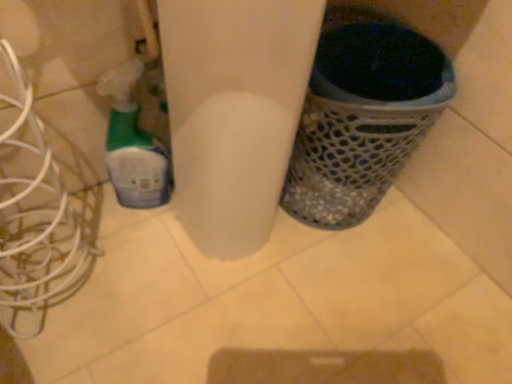
Question: Does translucent plastic spray bottle at left have a lesser width compared to white metallic wires at left?

Choices:
 (A) yes
 (B) no

Answer: (A)

Question: From a real-world perspective, is translucent plastic spray bottle at left physically below white metallic wires at left?

Choices:
 (A) yes
 (B) no

Answer: (A)

Question: Is translucent plastic spray bottle at left oriented away from white metallic wires at left?

Choices:
 (A) yes
 (B) no

Answer: (B)

Question: Is translucent plastic spray bottle at left further to camera compared to white metallic wires at left?

Choices:
 (A) yes
 (B) no

Answer: (A)

Question: Is translucent plastic spray bottle at left at the right side of white metallic wires at left?

Choices:
 (A) no
 (B) yes

Answer: (B)

Question: Considering the positions of metallic mesh waste bin at right and translucent plastic spray bottle at left in the image, is metallic mesh waste bin at right wider or thinner than translucent plastic spray bottle at left?

Choices:
 (A) thin
 (B) wide

Answer: (B)

Question: From a real-world perspective, is metallic mesh waste bin at right physically located above or below translucent plastic spray bottle at left?

Choices:
 (A) above
 (B) below

Answer: (A)

Question: From the image's perspective, is metallic mesh waste bin at right above or below translucent plastic spray bottle at left?

Choices:
 (A) below
 (B) above

Answer: (B)

Question: Considering the positions of metallic mesh waste bin at right and translucent plastic spray bottle at left in the image, is metallic mesh waste bin at right taller or shorter than translucent plastic spray bottle at left?

Choices:
 (A) tall
 (B) short

Answer: (A)

Question: From a real-world perspective, is translucent plastic spray bottle at left physically located above or below metallic mesh waste bin at right?

Choices:
 (A) below
 (B) above

Answer: (A)

Question: In the image, is translucent plastic spray bottle at left positioned in front of or behind metallic mesh waste bin at right?

Choices:
 (A) behind
 (B) front

Answer: (A)

Question: Is translucent plastic spray bottle at left spatially inside metallic mesh waste bin at right, or outside of it?

Choices:
 (A) inside
 (B) outside

Answer: (B)

Question: Based on their positions, is translucent plastic spray bottle at left located to the left or right of metallic mesh waste bin at right?

Choices:
 (A) left
 (B) right

Answer: (A)

Question: Is white metallic wires at left wider or thinner than metallic mesh waste bin at right?

Choices:
 (A) wide
 (B) thin

Answer: (B)

Question: Based on their positions, is white metallic wires at left located to the left or right of metallic mesh waste bin at right?

Choices:
 (A) right
 (B) left

Answer: (B)